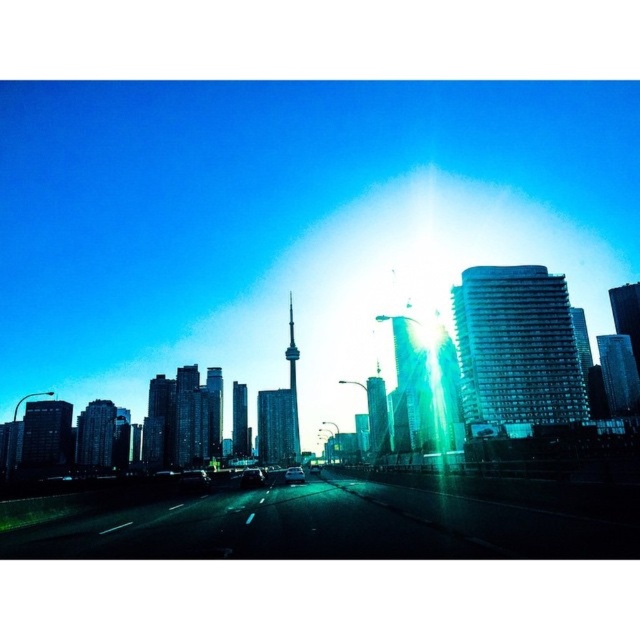
Between green glossy highway at center and shiny black sedan at center, which one is positioned higher?

green glossy highway at center is higher up.

Is point (504, 541) more distant than point (200, 484)?

No, (504, 541) is closer to viewer.

What are the coordinates of `green glossy highway at center` in the screenshot? It's located at (352, 522).

Consider the image. Is shiny black sedan at center to the left of shiny black car at center from the viewer's perspective?

Indeed, shiny black sedan at center is positioned on the left side of shiny black car at center.

Does shiny black sedan at center have a greater width compared to shiny black car at center?

Indeed, shiny black sedan at center has a greater width compared to shiny black car at center.

Does point (188, 476) come farther from viewer compared to point (248, 483)?

No, it is in front of (248, 483).

Identify the location of shiny black sedan at center. The height and width of the screenshot is (640, 640). (195, 477).

The image size is (640, 640). I want to click on shiny black car at center, so click(x=252, y=477).

Who is more forward, [243,472] or [289,477]?

Point [289,477] is more forward.

This screenshot has height=640, width=640. What do you see at coordinates (252, 477) in the screenshot?
I see `shiny black car at center` at bounding box center [252, 477].

Locate an element on the screen. This screenshot has height=640, width=640. shiny black car at center is located at coordinates (252, 477).